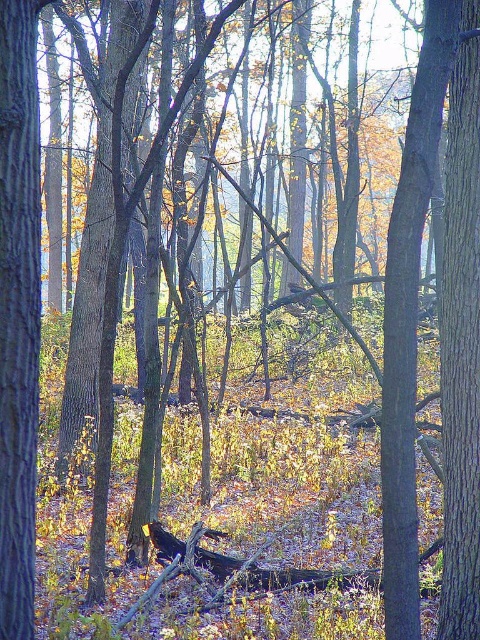
You are a hiker who wants to cross a stream but there are two obstacles in your path. You see a smooth brown tree trunk at left and a dark brown wood log at center. Which obstacle is closer to your left side?

The smooth brown tree trunk at left is to the left of dark brown wood log at center, so the smooth brown tree trunk at left is closer to your left side.

You are a hiker trying to determine the best path through the forest. You notice two smooth brown tree trunks. Which one is narrower, the smooth brown tree trunk at center or the smooth brown tree trunk at left?

The smooth brown tree trunk at center is smaller than the smooth brown tree trunk at left, so the smooth brown tree trunk at center is narrower.

You are a hiker who needs to cross a stream but only has a rope that can support a maximum width of 30 cm. You see the smooth brown tree trunk at left and the dark brown wood log at center. Which object can the rope safely secure around to cross the stream?

The smooth brown tree trunk at left has a lesser width compared to dark brown wood log at center. Since the rope can support a maximum width of 30 cm, the smooth brown tree trunk at left is narrower and can be safely secured with the rope, while the dark brown wood log at center may exceed the rope capacity.